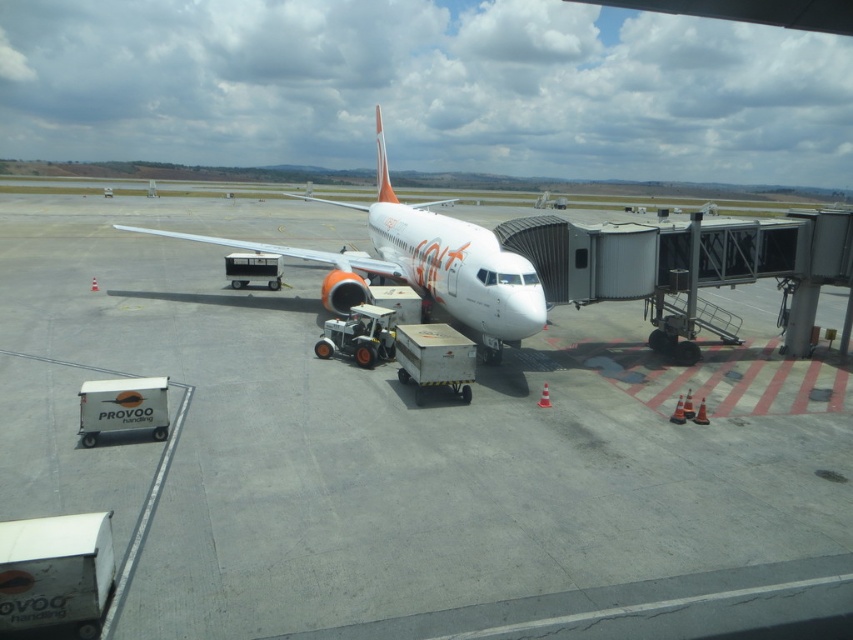
Question: Among these objects, which one is nearest to the camera?

Choices:
 (A) white glossy airplane at center
 (B) white smooth tarmac at center

Answer: (B)

Question: Which of the following is the closest to the observer?

Choices:
 (A) white glossy airplane at center
 (B) white smooth tarmac at center

Answer: (B)

Question: Can you confirm if white smooth tarmac at center is wider than white glossy airplane at center?

Choices:
 (A) no
 (B) yes

Answer: (B)

Question: Can you confirm if white smooth tarmac at center is positioned to the right of white glossy airplane at center?

Choices:
 (A) no
 (B) yes

Answer: (A)

Question: Does white smooth tarmac at center appear over white glossy airplane at center?

Choices:
 (A) yes
 (B) no

Answer: (B)